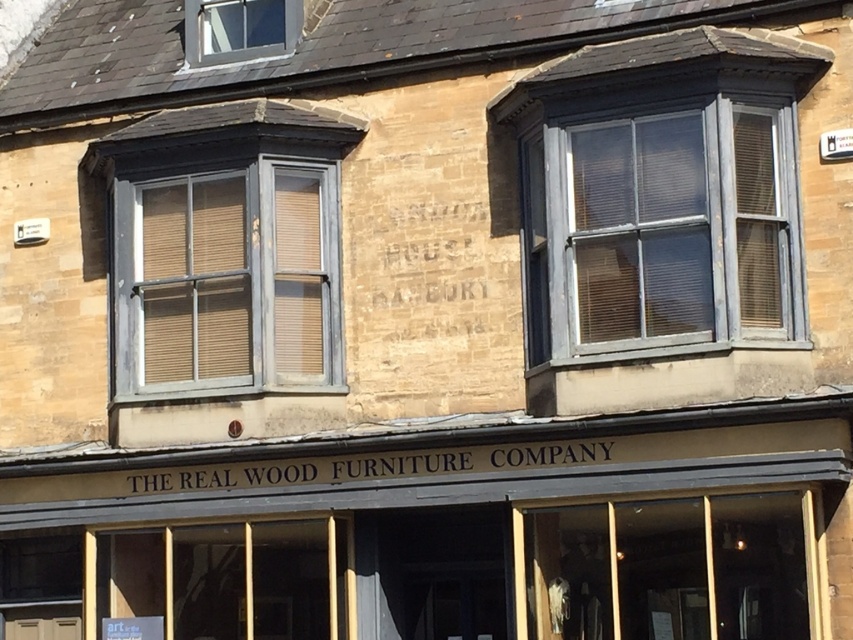
Question: Does blue-gray wood window at upper right appear on the left side of clear glass window at upper left?

Choices:
 (A) yes
 (B) no

Answer: (B)

Question: Among these points, which one is farthest from the camera?

Choices:
 (A) (712, 147)
 (B) (645, 484)

Answer: (A)

Question: Which object is positioned farthest from the clear glass window at upper left?

Choices:
 (A) blue-gray wood window at upper right
 (B) matte gray wood window at center left

Answer: (A)

Question: Which object is farther from the camera taking this photo?

Choices:
 (A) brown wooden signboard at center
 (B) blue-gray wood window at upper right

Answer: (B)

Question: Where is blue-gray wood window at upper right located in relation to matte gray wood window at center left in the image?

Choices:
 (A) right
 (B) left

Answer: (A)

Question: Is brown wooden signboard at center thinner than clear glass window at upper left?

Choices:
 (A) yes
 (B) no

Answer: (B)